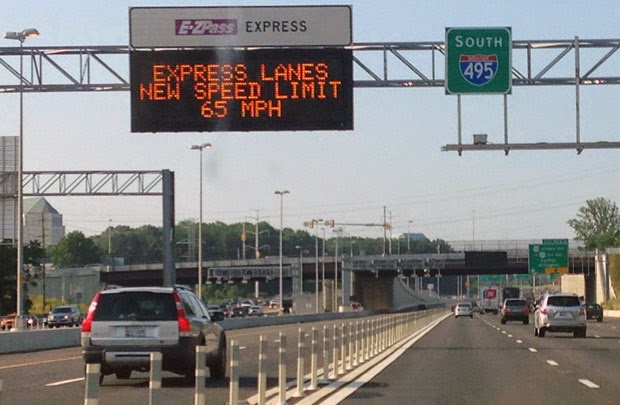
I want to click on light, so click(90, 315).